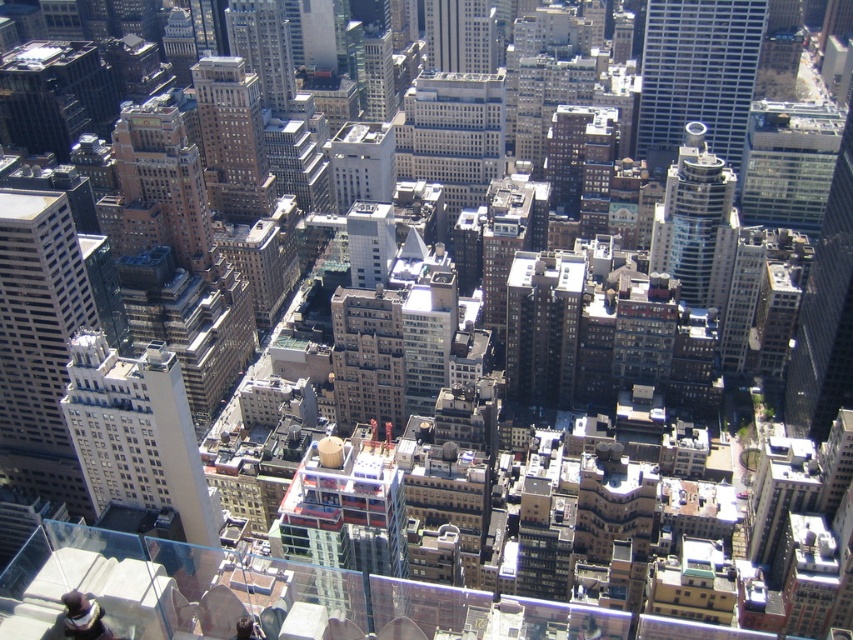
You are a drone operator tasked with flying a drone between the white smooth building at left and the red brick building at center. The drone has a maximum flight distance of 100 meters. Can the drone safely travel between these two buildings without exceeding its range?

The distance between the white smooth building at left and the red brick building at center is 104.57 meters. Since the drone can only fly up to 100 meters, it cannot safely travel between them without exceeding its range.

Looking at the urban landscape from above, you notice the glassy steel skyscraper at upper right and the white smooth building at center. Which of these two buildings is positioned more to the east?

The glassy steel skyscraper at upper right is to the right of the white smooth building at center, so it is positioned more to the east.

You are a drone operator flying over an urban area. Your drone is currently at the point marked by the coordinates point [137,435]. You need to fly towards the white smooth building at left. Is your current position already at the white smooth building at left?

The point [137,435] marks the white smooth building at left, so yes, your current position is already at the white smooth building at left.